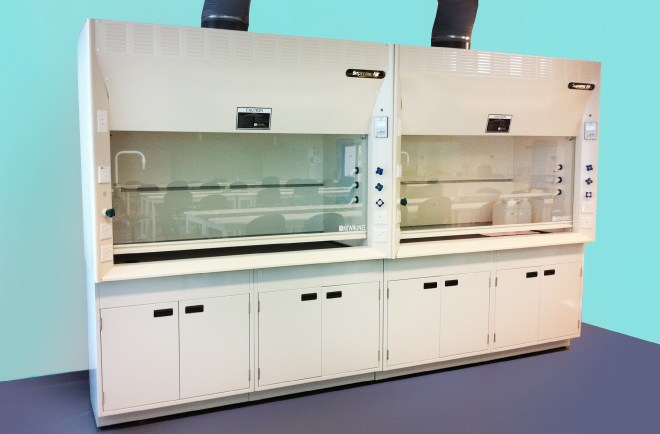
Locate an element on the screen. The width and height of the screenshot is (660, 434). floor is located at coordinates (464, 382).